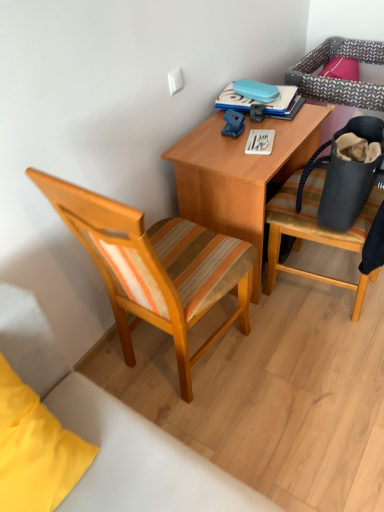
Question: Could you tell me if wooden striped cushioned chair at right, the 2th chair viewed from the left, is facing wooden desk at center?

Choices:
 (A) yes
 (B) no

Answer: (A)

Question: From the image's perspective, does wooden striped cushioned chair at right, the 1th chair positioned from the right, appear lower than wooden desk at center?

Choices:
 (A) yes
 (B) no

Answer: (A)

Question: From the image's perspective, is wooden striped cushioned chair at right, the 2th chair viewed from the left, located above wooden desk at center?

Choices:
 (A) yes
 (B) no

Answer: (B)

Question: Is wooden desk at center inside wooden striped cushioned chair at right, the 1th chair positioned from the right?

Choices:
 (A) no
 (B) yes

Answer: (A)

Question: Does wooden striped cushioned chair at right, the 1th chair positioned from the right, lie behind wooden desk at center?

Choices:
 (A) yes
 (B) no

Answer: (B)

Question: Is wooden striped cushioned chair at right, the 2th chair viewed from the left, thinner than wooden desk at center?

Choices:
 (A) no
 (B) yes

Answer: (A)

Question: Does blue hardcover book at upper center have a lesser width compared to blue plastic clip at center?

Choices:
 (A) no
 (B) yes

Answer: (A)

Question: Does blue hardcover book at upper center appear on the left side of blue plastic clip at center?

Choices:
 (A) no
 (B) yes

Answer: (A)

Question: From the image's perspective, would you say blue hardcover book at upper center is shown under blue plastic clip at center?

Choices:
 (A) yes
 (B) no

Answer: (B)

Question: From the image's perspective, is blue hardcover book at upper center above blue plastic clip at center?

Choices:
 (A) no
 (B) yes

Answer: (B)

Question: Is blue hardcover book at upper center closer to camera compared to blue plastic clip at center?

Choices:
 (A) yes
 (B) no

Answer: (B)

Question: Does blue hardcover book at upper center have a smaller size compared to blue plastic clip at center?

Choices:
 (A) no
 (B) yes

Answer: (A)

Question: Is the depth of matte black bag at right less than that of blue hardcover book at upper center?

Choices:
 (A) no
 (B) yes

Answer: (B)